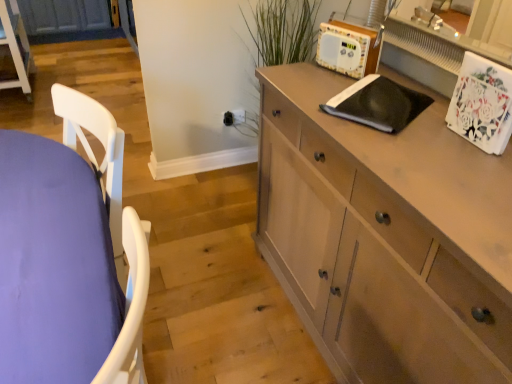
Question: Are light brown wood cabinet at lower left and light brown wood cabinet at right far apart?

Choices:
 (A) no
 (B) yes

Answer: (B)

Question: Considering the relative sizes of light brown wood cabinet at lower left and light brown wood cabinet at right in the image provided, is light brown wood cabinet at lower left bigger than light brown wood cabinet at right?

Choices:
 (A) yes
 (B) no

Answer: (B)

Question: Are light brown wood cabinet at lower left and light brown wood cabinet at right beside each other?

Choices:
 (A) yes
 (B) no

Answer: (B)

Question: Is light brown wood cabinet at lower left oriented away from light brown wood cabinet at right?

Choices:
 (A) no
 (B) yes

Answer: (A)

Question: Is light brown wood cabinet at lower left located outside light brown wood cabinet at right?

Choices:
 (A) yes
 (B) no

Answer: (A)

Question: From their relative heights in the image, would you say wooden radio at upper right is taller or shorter than light brown wood cabinet at right?

Choices:
 (A) short
 (B) tall

Answer: (A)

Question: In terms of width, does wooden radio at upper right look wider or thinner when compared to light brown wood cabinet at right?

Choices:
 (A) wide
 (B) thin

Answer: (B)

Question: From a real-world perspective, relative to light brown wood cabinet at right, is wooden radio at upper right vertically above or below?

Choices:
 (A) below
 (B) above

Answer: (B)

Question: Considering the positions of wooden radio at upper right and light brown wood cabinet at right in the image, is wooden radio at upper right bigger or smaller than light brown wood cabinet at right?

Choices:
 (A) small
 (B) big

Answer: (A)

Question: Considering the positions of light brown wood cabinet at right and wooden radio at upper right in the image, is light brown wood cabinet at right bigger or smaller than wooden radio at upper right?

Choices:
 (A) big
 (B) small

Answer: (A)

Question: Relative to wooden radio at upper right, is light brown wood cabinet at right in front or behind?

Choices:
 (A) behind
 (B) front

Answer: (B)

Question: Considering the positions of point (312, 195) and point (323, 44), is point (312, 195) closer or farther from the camera than point (323, 44)?

Choices:
 (A) closer
 (B) farther

Answer: (A)

Question: In terms of width, does light brown wood cabinet at right look wider or thinner when compared to wooden radio at upper right?

Choices:
 (A) wide
 (B) thin

Answer: (A)

Question: From the image's perspective, is light brown wood cabinet at right above or below purple fabric table at left?

Choices:
 (A) above
 (B) below

Answer: (B)

Question: From a real-world perspective, is light brown wood cabinet at right physically located above or below purple fabric table at left?

Choices:
 (A) above
 (B) below

Answer: (A)